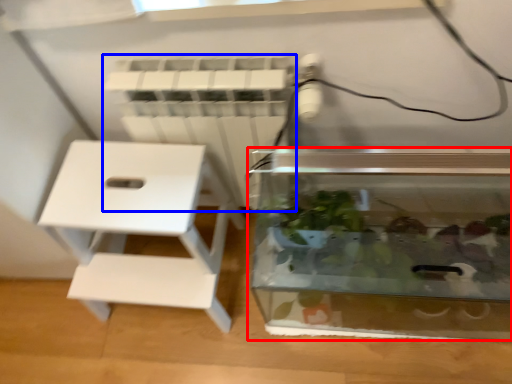
Question: Which of the following is the closest to the observer, glass box (highlighted by a red box) or radiator (highlighted by a blue box)?

Choices:
 (A) glass box
 (B) radiator

Answer: (A)